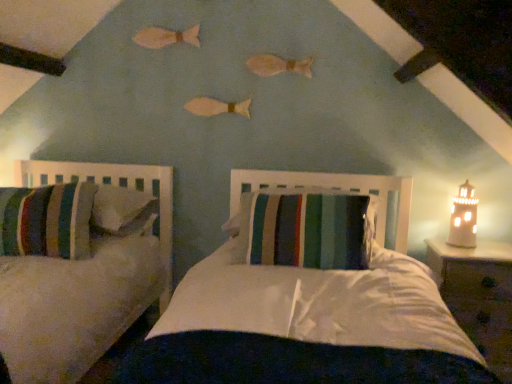
The height and width of the screenshot is (384, 512). What are the coordinates of `striped fabric pillow at center` in the screenshot? It's located at (306, 228).

I want to click on wooden nightstand at right, so click(x=478, y=296).

Would you say white ceramic lighthouse at right is part of striped fabric pillow at center's contents?

No, white ceramic lighthouse at right is not a part of striped fabric pillow at center.

Which of these two, striped fabric pillow at center or white ceramic lighthouse at right, is bigger?

striped fabric pillow at center is bigger.

From the image's perspective, which is below, striped fabric pillow at center or white ceramic lighthouse at right?

From the image's view, white ceramic lighthouse at right is below.

In the scene shown: Is white ceramic lighthouse at right taller than striped fabric pillow at center?

Indeed, white ceramic lighthouse at right has a greater height compared to striped fabric pillow at center.

From the image's perspective, which is above, white ceramic lighthouse at right or striped fabric pillow at center?

From the image's view, striped fabric pillow at center is above.

Measure the distance between white ceramic lighthouse at right and striped fabric pillow at center.

A distance of 74.91 centimeters exists between white ceramic lighthouse at right and striped fabric pillow at center.

How many degrees apart are the facing directions of white ceramic lighthouse at right and striped fabric pillow at center?

white ceramic lighthouse at right and striped fabric pillow at center are facing 96.6 degrees away from each other.

Which object is positioned more to the left, white ceramic lighthouse at right or wooden nightstand at right?

white ceramic lighthouse at right is more to the left.

How far apart are white ceramic lighthouse at right and wooden nightstand at right?

24.05 centimeters.

Is white ceramic lighthouse at right oriented away from wooden nightstand at right?

No, white ceramic lighthouse at right is not facing away from wooden nightstand at right.

From the image's perspective, is white ceramic lighthouse at right above or below wooden nightstand at right?

white ceramic lighthouse at right is situated higher than wooden nightstand at right in the image.

Is wooden nightstand at right facing away from striped fabric pillow at center?

No, wooden nightstand at right is not facing the opposite direction of striped fabric pillow at center.

Between wooden nightstand at right and striped fabric pillow at center, which one has less height?

Standing shorter between the two is striped fabric pillow at center.

Considering the points (501, 359) and (288, 212), which point is in front, point (501, 359) or point (288, 212)?

The point (288, 212) is more forward.

From a real-world perspective, is wooden nightstand at right physically located above or below striped fabric pillow at center?

Clearly, from a real-world perspective, wooden nightstand at right is below striped fabric pillow at center.

Is the position of wooden nightstand at right more distant than that of white ceramic lighthouse at right?

That is False.

From the image's perspective, between wooden nightstand at right and white ceramic lighthouse at right, who is located below?

wooden nightstand at right appears lower in the image.

Which of these two, wooden nightstand at right or white ceramic lighthouse at right, stands shorter?

Standing shorter between the two is white ceramic lighthouse at right.

Is wooden nightstand at right spatially inside white ceramic lighthouse at right, or outside of it?

The correct answer is: outside.

Considering the sizes of objects striped fabric pillow at center and wooden nightstand at right in the image provided, who is smaller, striped fabric pillow at center or wooden nightstand at right?

With smaller size is striped fabric pillow at center.

Between striped fabric pillow at center and wooden nightstand at right, which one has less height?

Standing shorter between the two is striped fabric pillow at center.

Considering the sizes of striped fabric pillow at center and wooden nightstand at right in the image, is striped fabric pillow at center wider or thinner than wooden nightstand at right?

striped fabric pillow at center is wider than wooden nightstand at right.

At what (x,y) coordinates should I click in order to perform the action: click on table lamp on the right side of striped fabric pillow at center. Please return your answer as a coordinate pair (x, y). The width and height of the screenshot is (512, 384). Looking at the image, I should click on (463, 218).

Where is `pillow above the white ceramic lighthouse at right (from the image's perspective)`? pillow above the white ceramic lighthouse at right (from the image's perspective) is located at coordinates click(x=306, y=228).

Based on their spatial positions, is wooden nightstand at right or striped fabric pillow at center further from white ceramic lighthouse at right?

The object further to white ceramic lighthouse at right is striped fabric pillow at center.

When comparing their distances from wooden nightstand at right, does striped fabric pillow at center or white ceramic lighthouse at right seem further?

striped fabric pillow at center.

From the image, which object appears to be nearer to wooden nightstand at right, white ceramic lighthouse at right or striped fabric pillow at center?

white ceramic lighthouse at right is positioned closer to the anchor wooden nightstand at right.

When comparing their distances from striped fabric pillow at center, does wooden nightstand at right or white ceramic lighthouse at right seem closer?

wooden nightstand at right lies closer to striped fabric pillow at center than the other object.

Looking at this image, from the image, which object appears to be nearer to striped fabric pillow at center, white ceramic lighthouse at right or wooden nightstand at right?

wooden nightstand at right lies closer to striped fabric pillow at center than the other object.

Estimate the real-world distances between objects in this image. Which object is closer to white ceramic lighthouse at right, striped fabric pillow at center or wooden nightstand at right?

The object closer to white ceramic lighthouse at right is wooden nightstand at right.

Identify the location of table lamp situated between striped fabric pillow at center and wooden nightstand at right from left to right. The width and height of the screenshot is (512, 384). [463, 218].